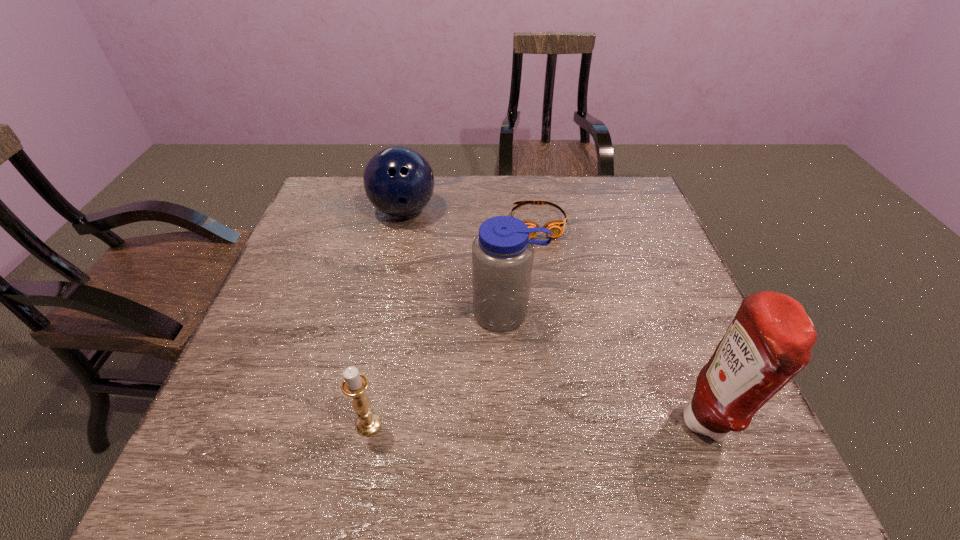
This screenshot has height=540, width=960. Identify the location of vacant spot on the desktop that is between the candle holder and the tallest object and is positioned with a carrying loop on the side of the second tallest object. (490, 424).

Where is `vacant space on the desktop that is between the candle holder and the rightmost object and is positioned on the surface of the bowling ball near the finger holes`? Image resolution: width=960 pixels, height=540 pixels. vacant space on the desktop that is between the candle holder and the rightmost object and is positioned on the surface of the bowling ball near the finger holes is located at coordinates (568, 423).

Where is `free space on the desktop that is between the candle holder and the rightmost object and is positioned with the lenses facing forward on the shortest object`? free space on the desktop that is between the candle holder and the rightmost object and is positioned with the lenses facing forward on the shortest object is located at coordinates pyautogui.click(x=579, y=423).